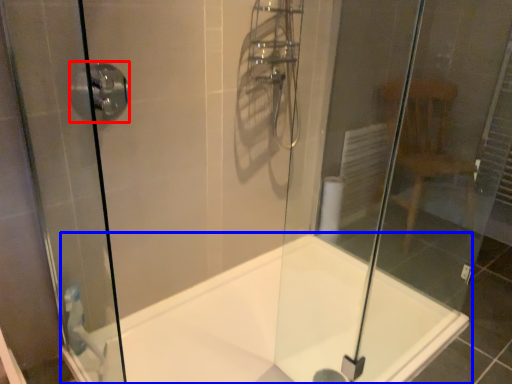
Question: Which of the following is the farthest to the observer, shower (highlighted by a red box) or bathtub (highlighted by a blue box)?

Choices:
 (A) shower
 (B) bathtub

Answer: (A)